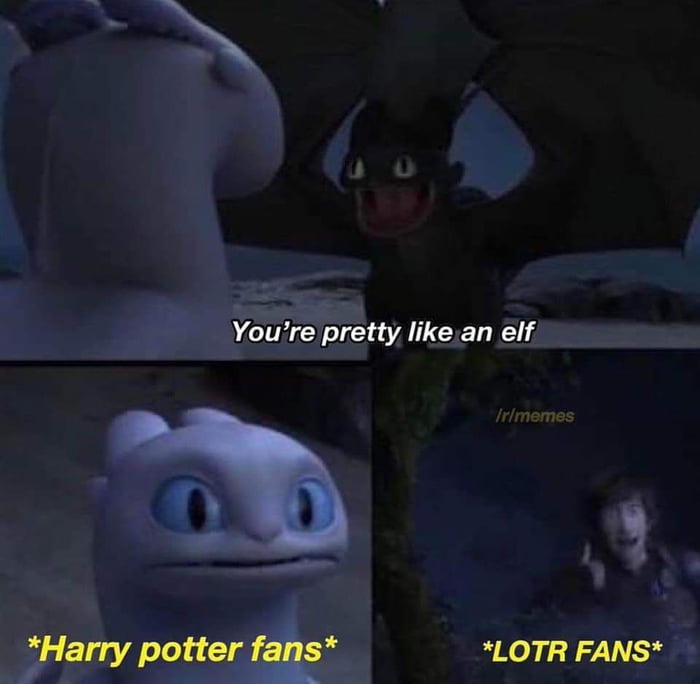
Find the location of a particular element. small box is located at coordinates (33, 415).